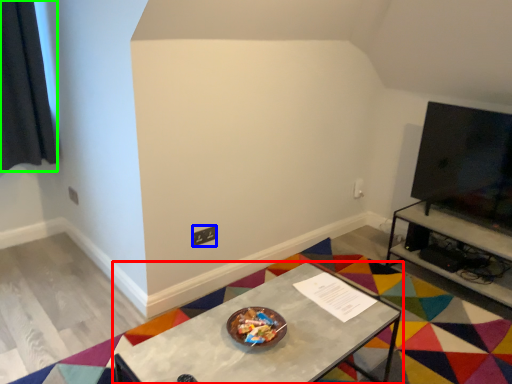
Question: Which object is the closest to the table (highlighted by a red box)? Choose among these: square (highlighted by a blue box) or curtain (highlighted by a green box).

Choices:
 (A) square
 (B) curtain

Answer: (A)